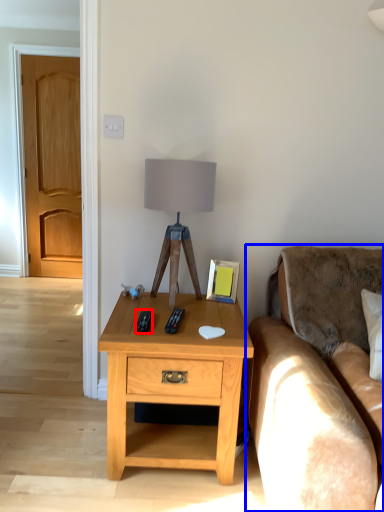
Question: Which point is closer to the camera, remote (highlighted by a red box) or studio couch (highlighted by a blue box)?

Choices:
 (A) remote
 (B) studio couch

Answer: (B)